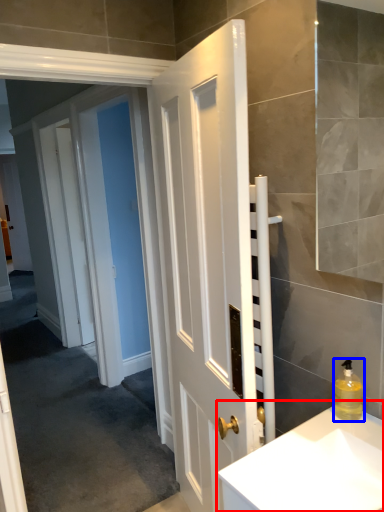
Question: Which object is further to the camera taking this photo, sink (highlighted by a red box) or soap dispenser (highlighted by a blue box)?

Choices:
 (A) sink
 (B) soap dispenser

Answer: (B)